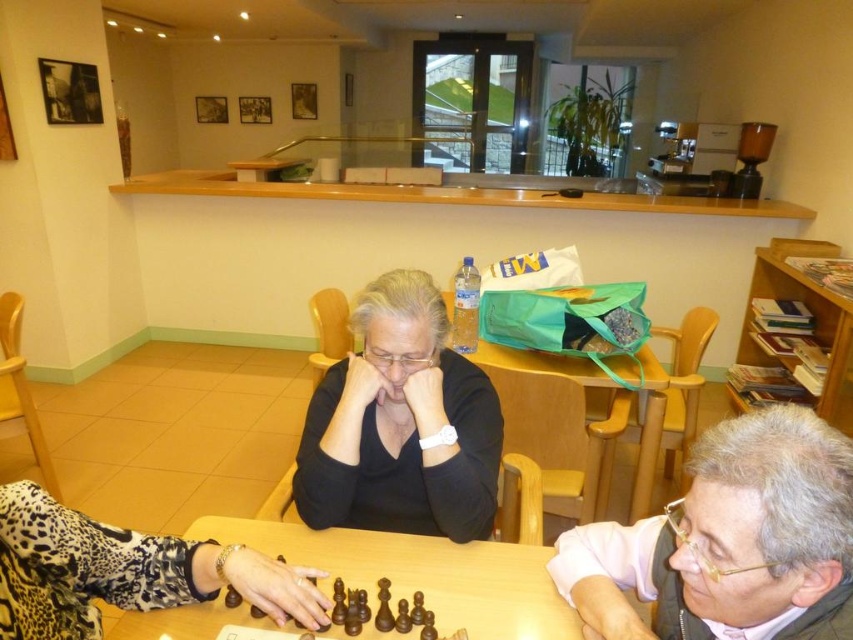
You are a photographer taking a picture of the scene. You need to ensure that the gray hair at upper right is visible above the wooden at center in your photo. Is this possible based on the current arrangement?

Yes, because the gray hair at upper right is already positioned above the wooden at center according to the description.

You are standing in the room and want to pick up the green fabric bag at center and the dark wood chess set at center. Which object will you need to reach for first, the one closer to you or the one further away?

The green fabric bag at center is closer to you, so you will need to reach for it first before the dark wood chess set at center which is further away.

You are organizing a chess tournament and need to transport the green fabric bag at center and the dark wood chess set at center. Which object requires a larger container for packing?

The green fabric bag at center requires a larger container because it is larger in size than the dark wood chess set at center.